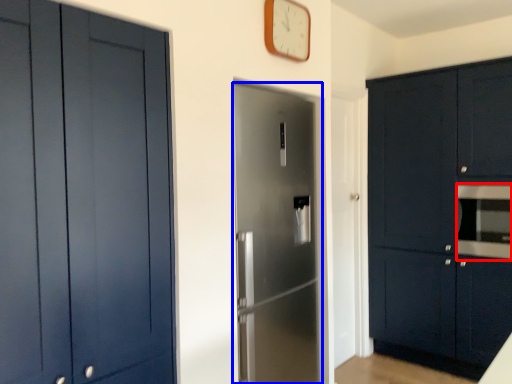
Question: Which object is closer to the camera taking this photo, oven (highlighted by a red box) or door (highlighted by a blue box)?

Choices:
 (A) oven
 (B) door

Answer: (B)